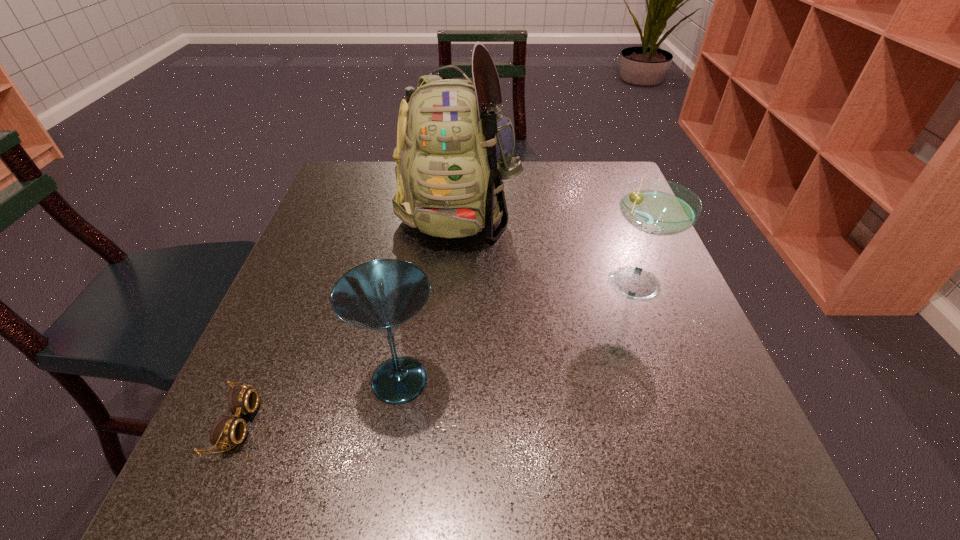
Locate an element on the screen. Image resolution: width=960 pixels, height=540 pixels. object at the far edge is located at coordinates (454, 150).

Find the location of a particular element. The image size is (960, 540). object that is at the near edge is located at coordinates (226, 431).

The image size is (960, 540). I want to click on object at the left edge, so click(x=226, y=431).

This screenshot has height=540, width=960. I want to click on object situated at the right edge, so click(656, 207).

The width and height of the screenshot is (960, 540). Find the location of `object positioned at the near left corner`. object positioned at the near left corner is located at coordinates (226, 431).

In the image, there is a desktop. Where is `vacant region at the left edge`? vacant region at the left edge is located at coordinates (253, 352).

Locate an element on the screen. Image resolution: width=960 pixels, height=540 pixels. free space at the right edge of the desktop is located at coordinates (709, 395).

At what (x,y) coordinates should I click in order to perform the action: click on vacant space at the near left corner. Please return your answer as a coordinate pair (x, y). This screenshot has height=540, width=960. Looking at the image, I should click on (307, 468).

You are a GUI agent. You are given a task and a screenshot of the screen. Output one action in this format:
    pyautogui.click(x=<x>, y=<y>)
    Task: Click on the free region at the far right corner
    The height and width of the screenshot is (540, 960).
    Given the screenshot: What is the action you would take?
    pyautogui.click(x=605, y=180)

The height and width of the screenshot is (540, 960). I want to click on free space at the near right corner of the desktop, so click(694, 475).